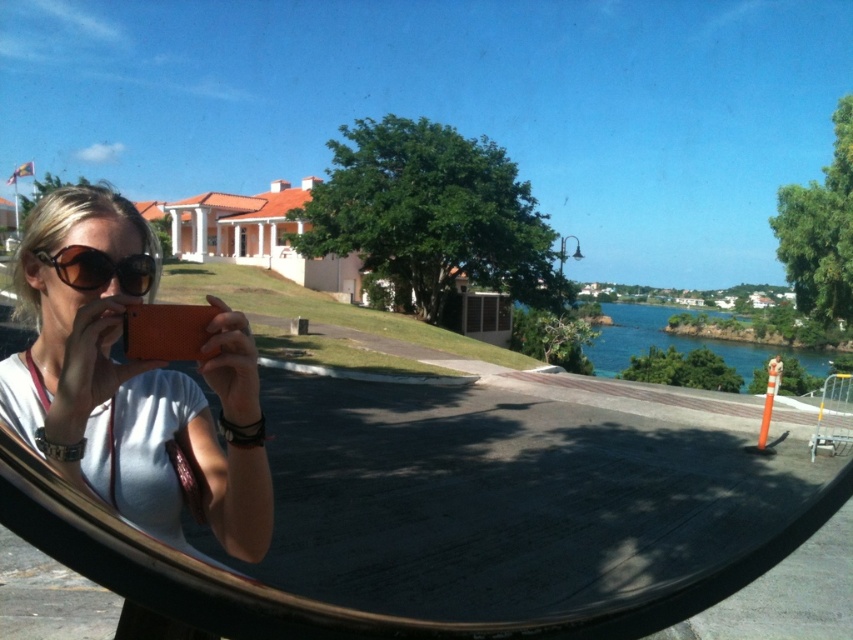
Does matte orange phone at center have a larger size compared to brown matte sunglasses at center?

Correct, matte orange phone at center is larger in size than brown matte sunglasses at center.

From the picture: Which is more to the left, matte orange phone at center or brown matte sunglasses at center?

From the viewer's perspective, matte orange phone at center appears more on the left side.

At what (x,y) coordinates should I click in order to perform the action: click on matte orange phone at center. Please return your answer as a coordinate pair (x, y). This screenshot has height=640, width=853. Looking at the image, I should click on (x=131, y=380).